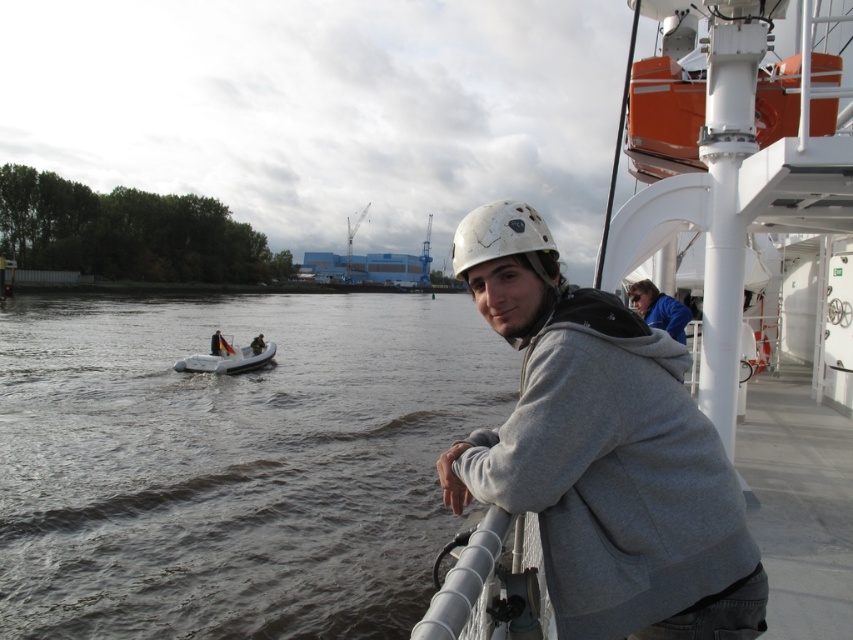
Between gray matte jacket at center and white matte helmet at upper center, which one appears on the right side from the viewer's perspective?

From the viewer's perspective, white matte helmet at upper center appears more on the right side.

Does gray matte jacket at center have a greater height compared to white matte helmet at upper center?

Indeed, gray matte jacket at center has a greater height compared to white matte helmet at upper center.

Who is more forward, (717, 497) or (480, 212)?

Point (717, 497) is in front.

What are the coordinates of `gray matte jacket at center` in the screenshot? It's located at (602, 452).

From the picture: Is gray matte jacket at center positioned behind dark gray rubber boat at center-left?

No, gray matte jacket at center is in front of dark gray rubber boat at center-left.

Describe the element at coordinates (602, 452) in the screenshot. The width and height of the screenshot is (853, 640). I see `gray matte jacket at center` at that location.

Locate an element on the screen. The height and width of the screenshot is (640, 853). gray matte jacket at center is located at coordinates (602, 452).

Who is positioned more to the right, gray matte jacket at center or white rubber boat at center?

From the viewer's perspective, gray matte jacket at center appears more on the right side.

Between point (576, 532) and point (187, 358), which one is positioned in front?

Positioned in front is point (576, 532).

At what (x,y) coordinates should I click in order to perform the action: click on gray matte jacket at center. Please return your answer as a coordinate pair (x, y). Looking at the image, I should click on (602, 452).